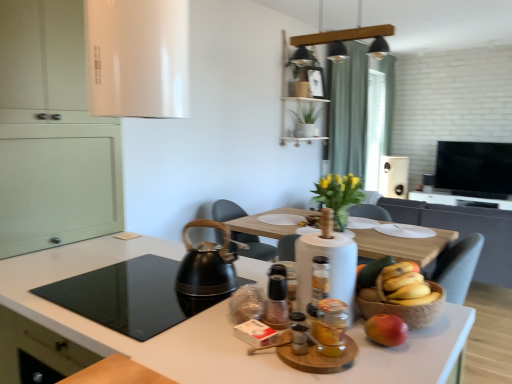
Question: Should I look upward or downward to see translucent glass bottle at center, positioned as the 3th bottle in front-to-back order?

Choices:
 (A) down
 (B) up

Answer: (A)

Question: Considering the relative positions of black glass cooktop at lower left and green fabric curtain at upper center in the image provided, is black glass cooktop at lower left to the left of green fabric curtain at upper center from the viewer's perspective?

Choices:
 (A) yes
 (B) no

Answer: (A)

Question: Is the position of black glass cooktop at lower left more distant than that of green fabric curtain at upper center?

Choices:
 (A) no
 (B) yes

Answer: (A)

Question: From a real-world perspective, is black glass cooktop at lower left on top of green fabric curtain at upper center?

Choices:
 (A) no
 (B) yes

Answer: (A)

Question: Can you see black glass cooktop at lower left touching green fabric curtain at upper center?

Choices:
 (A) no
 (B) yes

Answer: (A)

Question: Considering the relative positions of black glass cooktop at lower left and green fabric curtain at upper center in the image provided, is black glass cooktop at lower left to the right of green fabric curtain at upper center from the viewer's perspective?

Choices:
 (A) yes
 (B) no

Answer: (B)

Question: Could you tell me if black glass cooktop at lower left is facing green fabric curtain at upper center?

Choices:
 (A) yes
 (B) no

Answer: (B)

Question: Considering the relative sizes of translucent glass jar at center, positioned as the first bottle in front-to-back order, and translucent glass bottle at center, positioned as the 3th bottle in front-to-back order, in the image provided, is translucent glass jar at center, positioned as the first bottle in front-to-back order, shorter than translucent glass bottle at center, positioned as the 3th bottle in front-to-back order,?

Choices:
 (A) yes
 (B) no

Answer: (A)

Question: From the image's perspective, is translucent glass jar at center, positioned as the first bottle in front-to-back order, beneath translucent glass bottle at center, positioned as the 3th bottle in front-to-back order?

Choices:
 (A) yes
 (B) no

Answer: (A)

Question: Does translucent glass jar at center, positioned as the first bottle in front-to-back order, have a smaller size compared to translucent glass bottle at center, positioned as the 3th bottle in front-to-back order?

Choices:
 (A) no
 (B) yes

Answer: (A)

Question: Does translucent glass jar at center, the third bottle positioned from the back, have a larger size compared to translucent glass bottle at center, placed as the first bottle when sorted from back to front?

Choices:
 (A) yes
 (B) no

Answer: (A)

Question: Does translucent glass jar at center, positioned as the first bottle in front-to-back order, come in front of translucent glass bottle at center, positioned as the 3th bottle in front-to-back order?

Choices:
 (A) yes
 (B) no

Answer: (A)

Question: Does translucent glass jar at center, positioned as the first bottle in front-to-back order, contain translucent glass bottle at center, placed as the first bottle when sorted from back to front?

Choices:
 (A) no
 (B) yes

Answer: (A)

Question: Does matte white vase at center come behind green fabric curtain at upper center?

Choices:
 (A) yes
 (B) no

Answer: (B)